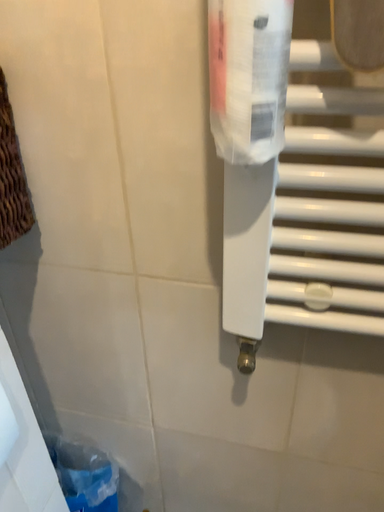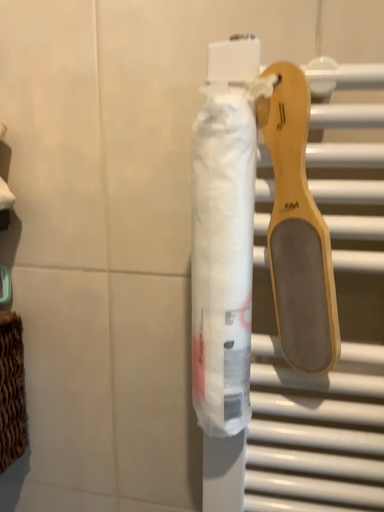
Question: Which way did the camera rotate in the video?

Choices:
 (A) rotated downward
 (B) rotated upward

Answer: (B)